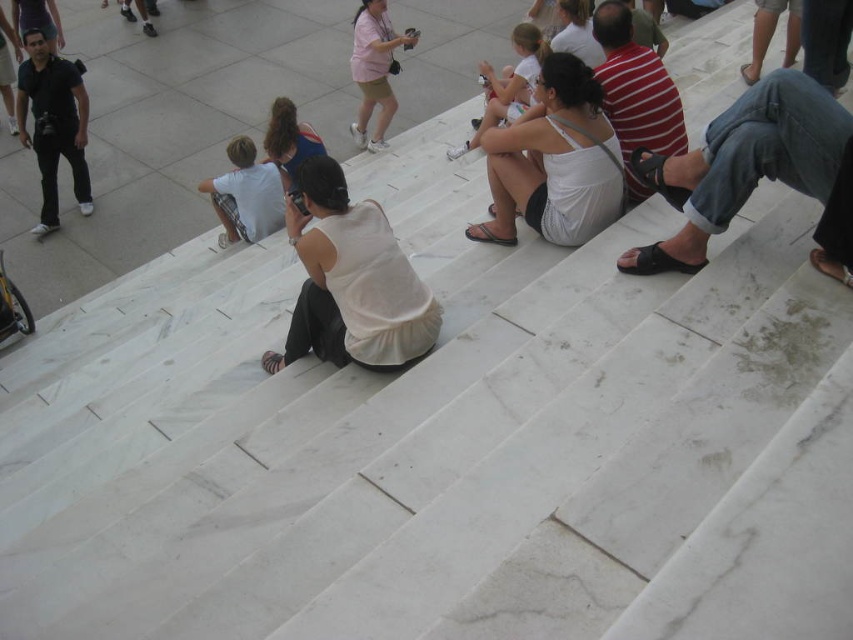
Does point (662, 120) come farther from viewer compared to point (541, 33)?

That is False.

Find the location of a particular element. striped cotton shirt at center is located at coordinates (635, 88).

Consider the image. Is white cotton tank top at center bigger than white cotton shirt at center?

Yes.

Does point (408, 288) lie in front of point (209, 186)?

Yes, it is.

Which is behind, point (402, 307) or point (227, 154)?

Point (227, 154)

The height and width of the screenshot is (640, 853). What are the coordinates of `white cotton tank top at center` in the screenshot? It's located at (351, 282).

Image resolution: width=853 pixels, height=640 pixels. I want to click on white cotton tank top at center, so click(351, 282).

Does white cotton tank top at center appear on the right side of matte black camera at left?

Correct, you'll find white cotton tank top at center to the right of matte black camera at left.

You are a GUI agent. You are given a task and a screenshot of the screen. Output one action in this format:
    pyautogui.click(x=<x>, y=<y>)
    Task: Click on the white cotton tank top at center
    The width and height of the screenshot is (853, 640).
    Given the screenshot: What is the action you would take?
    pyautogui.click(x=351, y=282)